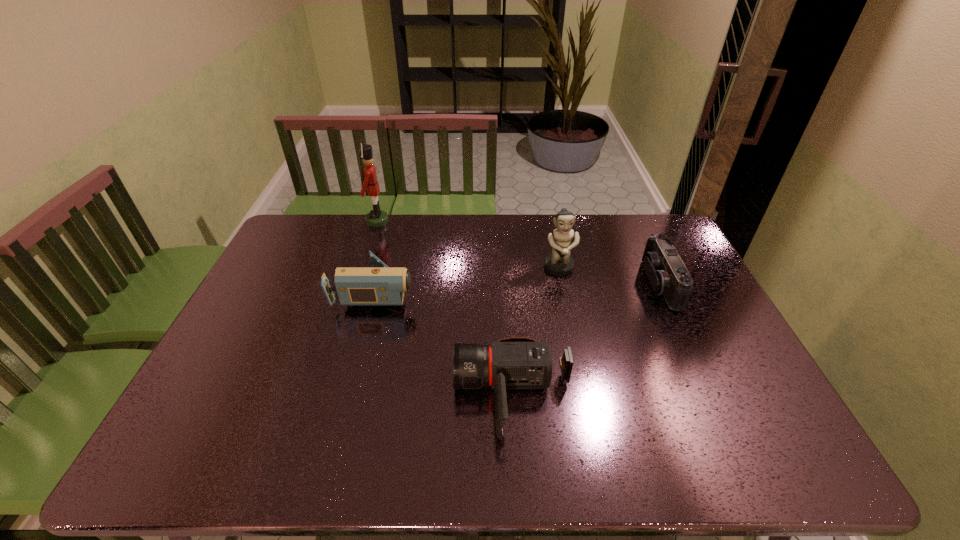
Identify the location of free space in the image that satisfies the following two spatial constraints: 1. on the front-facing side of the fourth shortest object; 2. on the side of the leftmost camcorder with the flip-out screen. (564, 291).

This screenshot has height=540, width=960. Identify the location of free space that satisfies the following two spatial constraints: 1. on the front-facing side of the second tallest object; 2. on the lens of the nearest object. (587, 396).